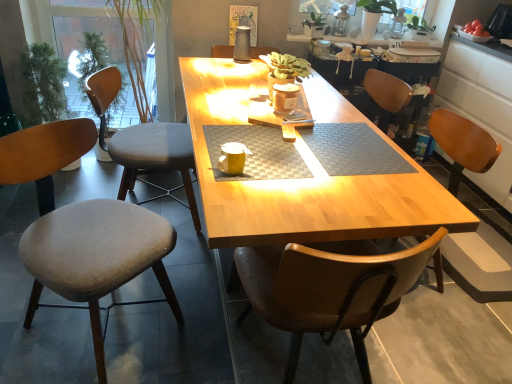
Question: Looking at the image, does gray fabric chair at left, arranged as the 2th chair when viewed from the right, seem bigger or smaller compared to velvet grey chair at left, the 1th chair in the left-to-right sequence?

Choices:
 (A) small
 (B) big

Answer: (B)

Question: Considering the relative positions of gray fabric chair at left, the second chair positioned from the left, and velvet grey chair at left, positioned as the third chair in right-to-left order, in the image provided, is gray fabric chair at left, the second chair positioned from the left, to the left or to the right of velvet grey chair at left, positioned as the third chair in right-to-left order,?

Choices:
 (A) right
 (B) left

Answer: (A)

Question: Which is farther from the wooden chair at right, which ranks as the 1th chair in right-to-left order?

Choices:
 (A) velvet grey chair at left, positioned as the third chair in right-to-left order
 (B) green matte plant at upper right
 (C) yellow matte coffee cup at center
 (D) gray fabric chair at left, arranged as the 2th chair when viewed from the right
 (E) wooden table at center

Answer: (A)

Question: Estimate the real-world distances between objects in this image. Which object is farther from the velvet grey chair at left, positioned as the third chair in right-to-left order?

Choices:
 (A) green matte plant at upper right
 (B) gray fabric chair at left, arranged as the 2th chair when viewed from the right
 (C) wooden chair at right, the 3th chair in the left-to-right sequence
 (D) wooden table at center
 (E) yellow matte coffee cup at center

Answer: (A)